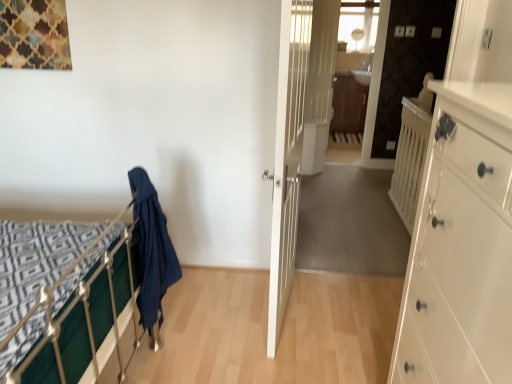
Where is `space that is in front of white wooden balustrade at right`? space that is in front of white wooden balustrade at right is located at coordinates [x=379, y=240].